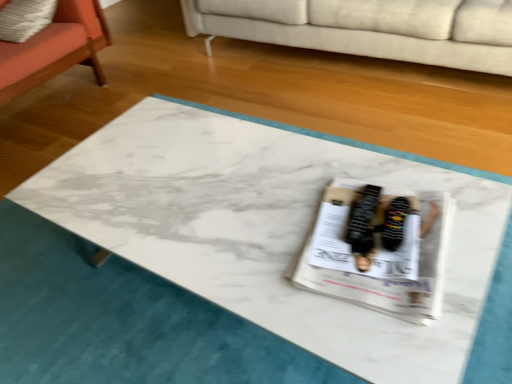
Find the location of a particular element. This screenshot has height=384, width=512. free point below white glossy magazine at center (from a real-world perspective) is located at coordinates pos(356,254).